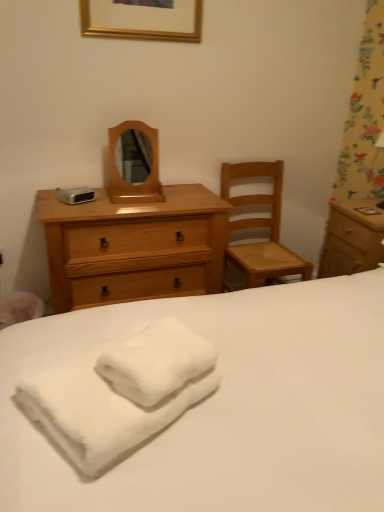
Question: From their relative heights in the image, would you say light brown wooden chest of drawers at center-left is taller or shorter than gold wooden picture frame at upper center?

Choices:
 (A) tall
 (B) short

Answer: (A)

Question: Is light brown wooden chest of drawers at center-left to the left or to the right of gold wooden picture frame at upper center in the image?

Choices:
 (A) left
 (B) right

Answer: (A)

Question: Based on their relative distances, which object is farther from the gold wooden picture frame at upper center?

Choices:
 (A) wooden mirror at center
 (B) wooden nightstand at right
 (C) white fluffy bath towel at lower left
 (D) wooden chair at right
 (E) light brown wooden chest of drawers at center-left

Answer: (C)

Question: Estimate the real-world distances between objects in this image. Which object is farther from the white fluffy bath towel at lower left?

Choices:
 (A) gold wooden picture frame at upper center
 (B) wooden nightstand at right
 (C) light brown wooden chest of drawers at center-left
 (D) white soft towel at center
 (E) wooden chair at right

Answer: (A)